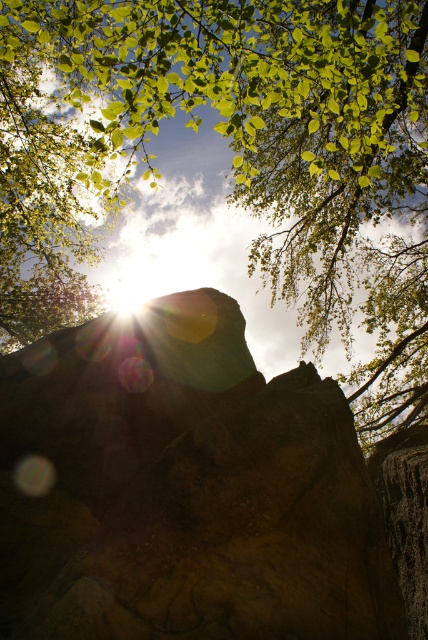
You are an explorer trying to estimate the sizes of objects in the scene. Based on the image, which object is smaller between the brown rough rock at center and the green leafy tree at upper center?

The brown rough rock at center is smaller compared to the green leafy tree at upper center.

You are a hiker who wants to take a photo of the brown rough rock at center and the green leafy tree at upper center. Which object should you focus on first if you want both to be in sharp focus?

You should focus on the brown rough rock at center first because it is closer to the viewer than the green leafy tree at upper center, ensuring both are in focus by focusing on the closer object.

You are a photographer standing at the edge of a forest path. You want to take a photo of the brown rough rock at center. If your camera has a maximum focus range of 10 feet, will you need to adjust your position to capture the rock clearly?

The brown rough rock at center is 13.50 feet away from the camera. Since the camera can only focus up to 10 feet, you need to move closer to the rock to ensure it is within the focus range.